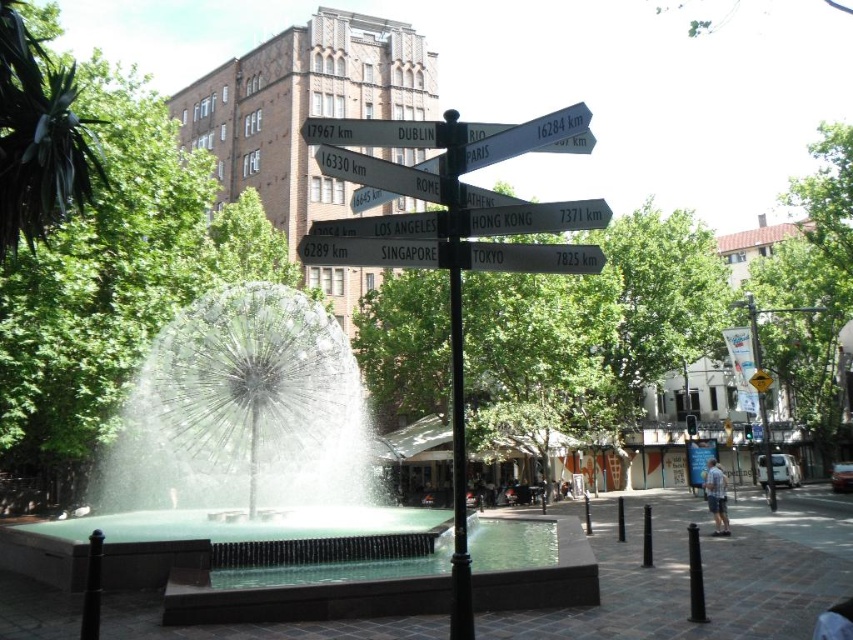
You are standing in the plaza and want to walk from the fountain to the point marked by point (445, 177) and then to point (334, 163). Which point will you reach first?

You will reach point (445, 177) first because it is closer to you than point (334, 163), which is further away.

You are a city planner evaluating the plaza layout. You need to install a new security camera that must be placed at least 2 meters above the ground to avoid tampering. Given the heights of the polished stone fountain at center and the white plastic sign at center, which object would be a suitable mounting point for the camera?

The polished stone fountain at center is taller than the white plastic sign at center. Since the camera needs to be at least 2 meters high, the fountain would be the better option as it likely reaches the required height, whereas the sign may be too short.